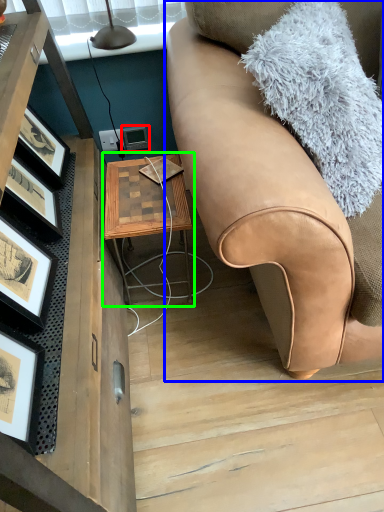
Question: Which object is positioned farthest from picture frame (highlighted by a red box)? Select from studio couch (highlighted by a blue box) and table (highlighted by a green box).

Choices:
 (A) studio couch
 (B) table

Answer: (A)